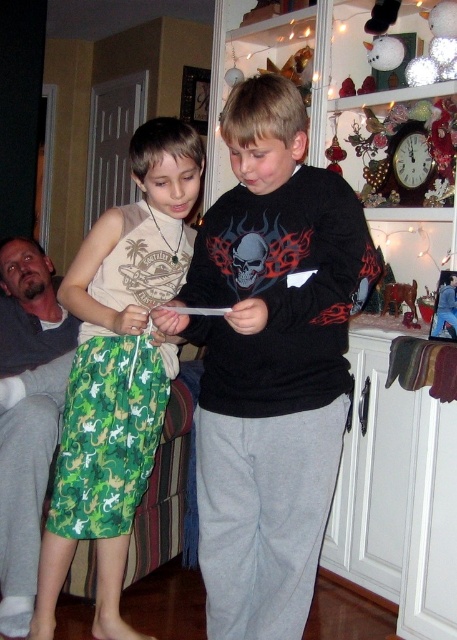
Question: Which point is closer to the camera taking this photo?

Choices:
 (A) (290, 170)
 (B) (127, 531)
 (C) (0, 362)

Answer: (A)

Question: Estimate the real-world distances between objects in this image. Which object is closer to the black matte sweatshirt at center?

Choices:
 (A) green camouflage shorts at left
 (B) gray fabric pants at lower left

Answer: (A)

Question: Is green camouflage shorts at left positioned behind gray fabric pants at lower left?

Choices:
 (A) no
 (B) yes

Answer: (A)

Question: Does black matte sweatshirt at center come behind green camouflage shorts at left?

Choices:
 (A) yes
 (B) no

Answer: (B)

Question: Estimate the real-world distances between objects in this image. Which object is closer to the black matte sweatshirt at center?

Choices:
 (A) gray fabric pants at lower left
 (B) green camouflage shorts at left

Answer: (B)

Question: Is black matte sweatshirt at center closer to the viewer compared to green camouflage shorts at left?

Choices:
 (A) yes
 (B) no

Answer: (A)